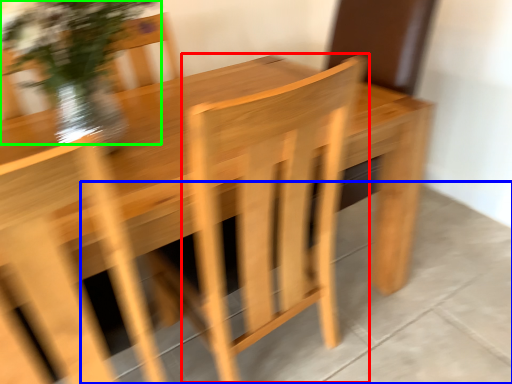
Question: Which is farther away from armchair (highlighted by a red box)? concrete (highlighted by a blue box) or floral arrangement (highlighted by a green box)?

Choices:
 (A) concrete
 (B) floral arrangement

Answer: (B)